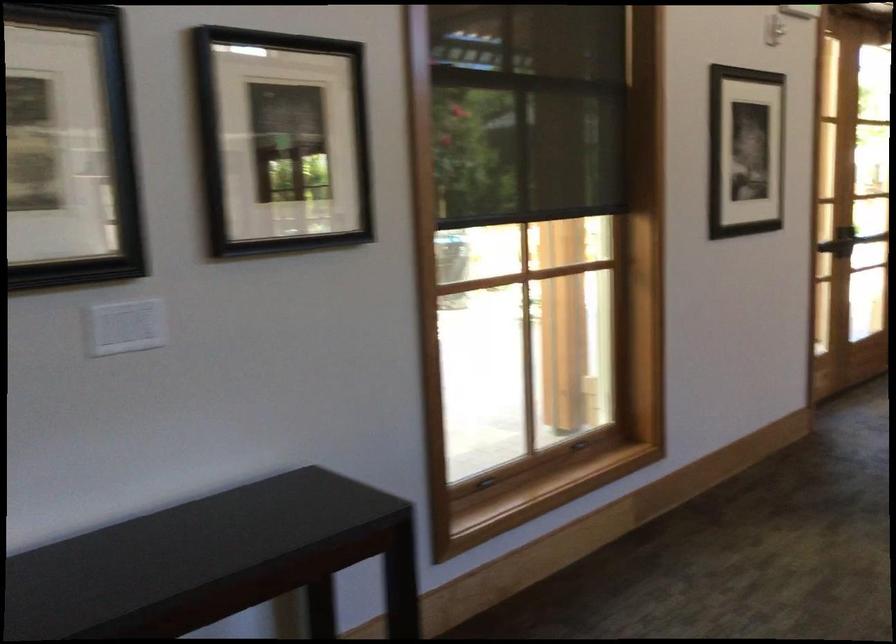
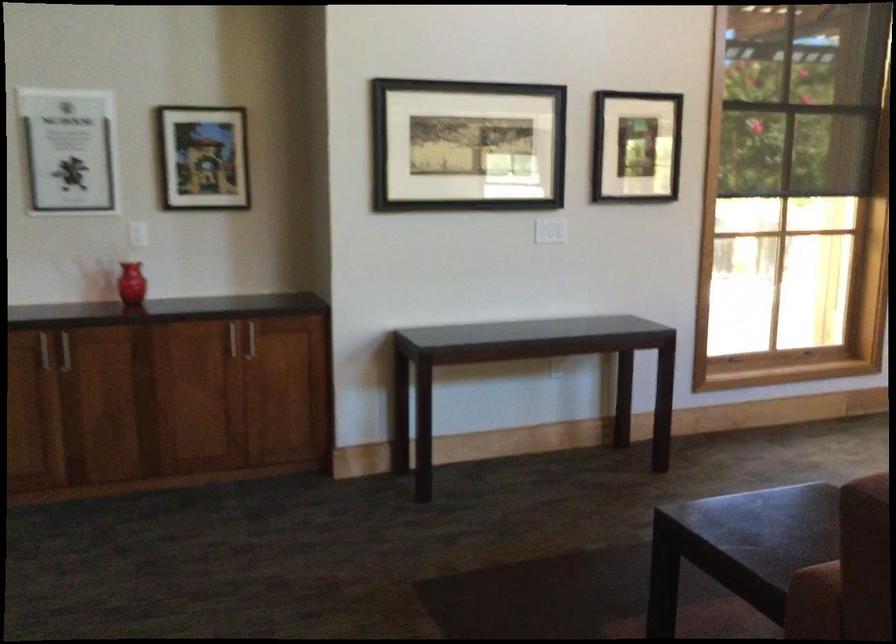
Question: In a continuous first-person perspective shot, in which direction is the camera moving?

Choices:
 (A) Left
 (B) Right
 (C) Forward
 (D) Backward

Answer: (D)